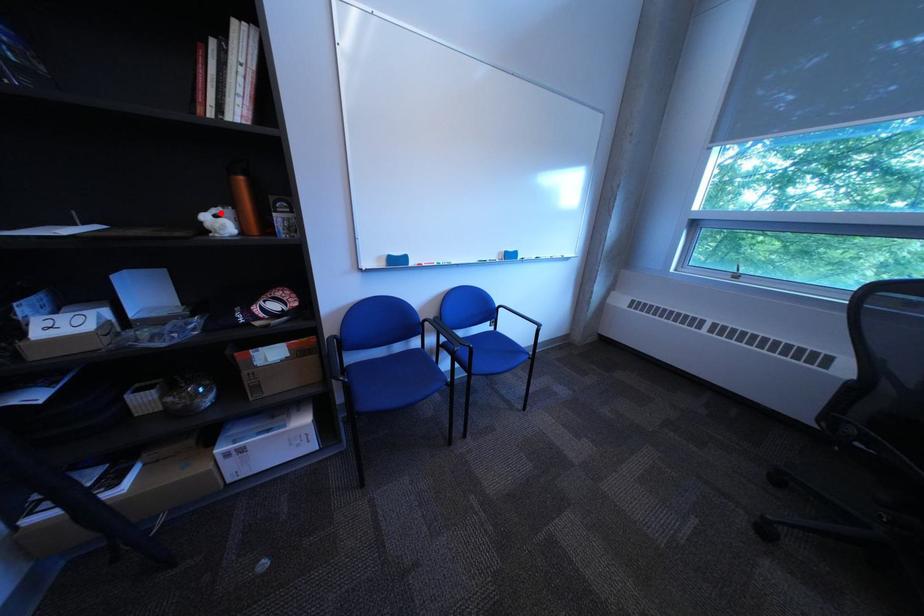
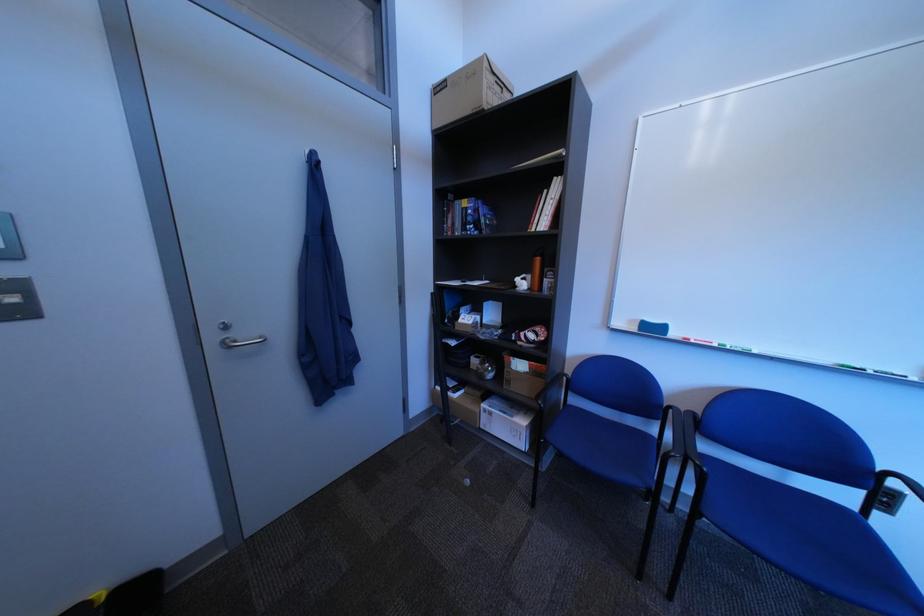
The point at the highlighted location is marked in the first image. Where is the corresponding point in the second image?

(535, 278)